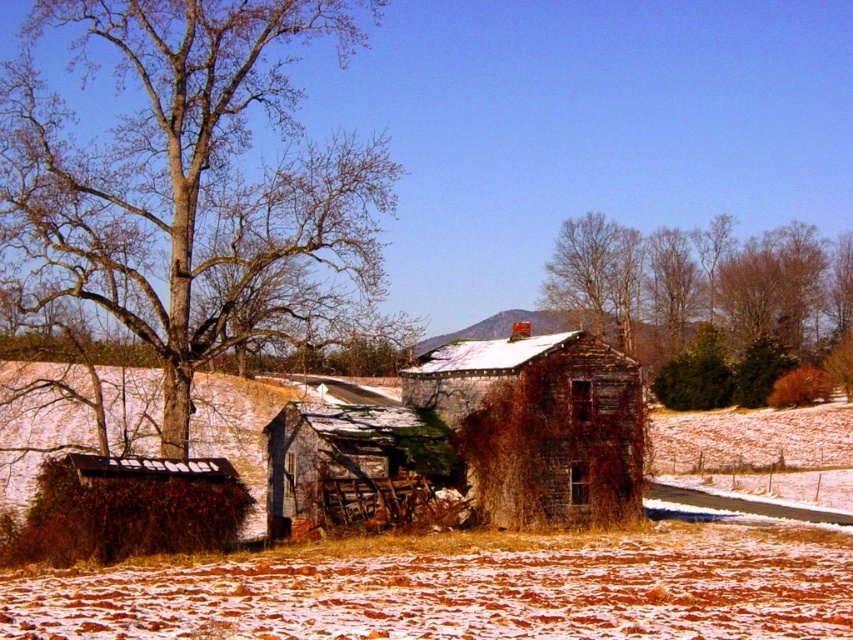
You are standing in the snowy field and want to walk towards the brown textured tree at upper right and the rusty stone hut at center. Which direction should you head to reach the tree first?

The brown textured tree at upper right is to the right of the rusty stone hut at center, so you should head right to reach the tree first before the hut.

You are a hiker trying to navigate through the snowy field towards the rusty stone hut at center. There is a brown textured tree at upper right that you can see from your current position. Which direction should you move relative to the tree to reach the hut?

The brown textured tree at upper right is located above the rusty stone hut at center, so you should move downward from the tree to reach the hut.

You are an environmental scientist assessing the area. You need to determine which object, the brown textured tree at left or the rusty stone hut at center, has a larger width to decide where to place a sensor that requires more space. Which object is wider?

The brown textured tree at left might be wider than rusty stone hut at center, so the sensor should be placed near the brown textured tree at left as it has a larger width.